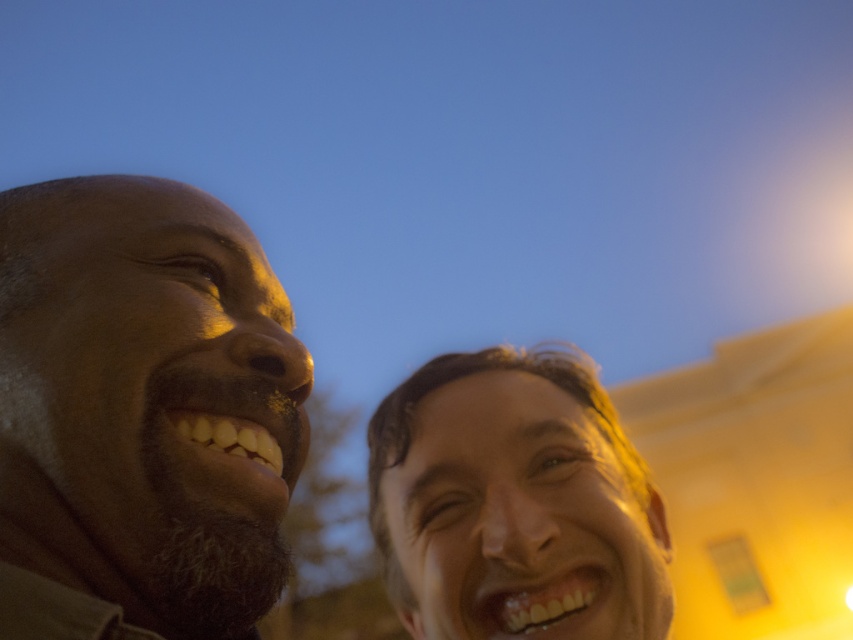
You are a photographer trying to capture a closeup shot of both the matte brown beard at left and the shiny golden hair at center. Given that your camera has a maximum focus range of 12 inches, can you fit both subjects within the frame without moving closer?

The distance between the matte brown beard at left and the shiny golden hair at center is 11.76 inches, which is within the camera maximum focus range of 12 inches. Therefore, you can fit both subjects within the frame without moving closer.

You are standing at the origin point of the image. Which of the two points, point (33, 604) or point (538, 372), is closer to you?

Point (33, 604) is closer to you because it is in front of point (538, 372).

Looking at this image, you are a photographer trying to capture the matte brown beard at left in the image. Where exactly should you focus your camera to ensure the beard is in the frame?

To capture the matte brown beard at left, focus your camera at the coordinates point [141,413] where the matte brown beard at left is located.